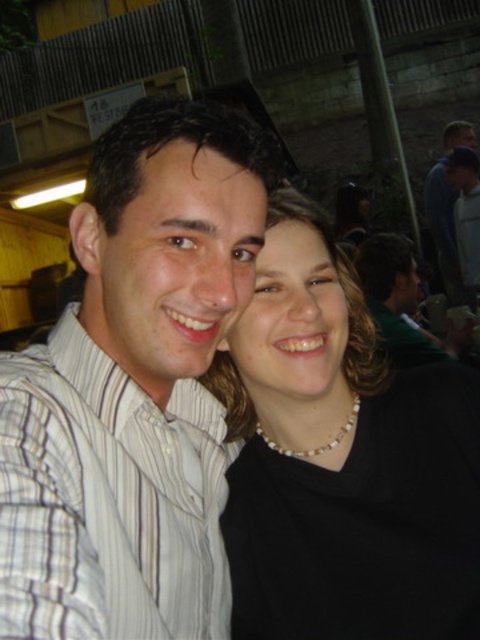
You are a photographer trying to focus on the pearl necklace at center and the dark blue shirt at upper right. Which object is positioned lower in the image?

The pearl necklace at center is located below dark blue shirt at upper right, so the pearl necklace at center is positioned lower in the image.

You are a photographer trying to focus on the pearl necklace at center and the dark blue shirt at upper right. Which object should you adjust your focus to first if you want to capture both clearly in the same frame?

The pearl necklace at center should be focused on first because it is in front of the dark blue shirt at upper right, so adjusting focus starting from the closer object ensures both can be in focus.

You are a photographer adjusting your camera settings to capture a closeup of the pearl necklace at center. The camera has a focal length of 50mm. Based on the distance, will the necklace fill the frame adequately for a detailed closeup?

The pearl necklace at center is 3.66 feet away from the camera. With a 50mm focal length, this distance may not be sufficient to fill the frame adequately for a detailed closeup. The photographer may need to use a longer focal length or move closer to the subject.